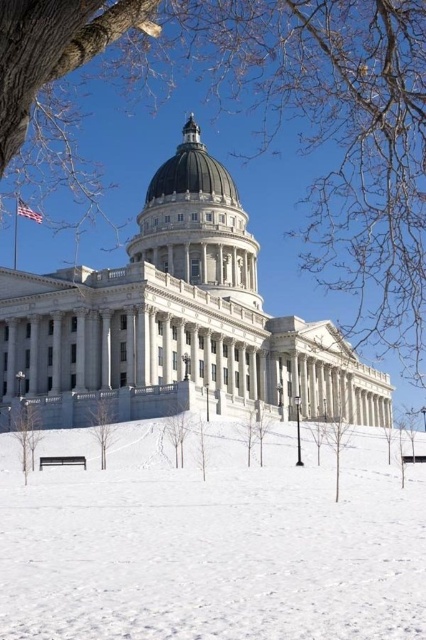
Which of these two, smooth brown tree at center or bare branches at center, stands shorter?

With less height is smooth brown tree at center.

Can you confirm if smooth brown tree at center is shorter than bare branches at center?

Correct, smooth brown tree at center is not as tall as bare branches at center.

Find the location of a particular element. The width and height of the screenshot is (426, 640). smooth brown tree at center is located at coordinates (100, 420).

Which of these two, matte gray dome at center or green leafy tree at lower left, stands taller?

With more height is matte gray dome at center.

Can you confirm if matte gray dome at center is wider than green leafy tree at lower left?

Yes.

Who is more distant from viewer, (169, 179) or (32, 442)?

The point (169, 179) is more distant.

Locate an element on the screen. The height and width of the screenshot is (640, 426). matte gray dome at center is located at coordinates (192, 170).

Is matte gray dome at center wider than smooth brown tree at center?

Yes, matte gray dome at center is wider than smooth brown tree at center.

In the scene shown: Is matte gray dome at center smaller than smooth brown tree at center?

No, matte gray dome at center is not smaller than smooth brown tree at center.

Does point (167, 166) lie in front of point (98, 419)?

That is False.

The height and width of the screenshot is (640, 426). Identify the location of matte gray dome at center. (192, 170).